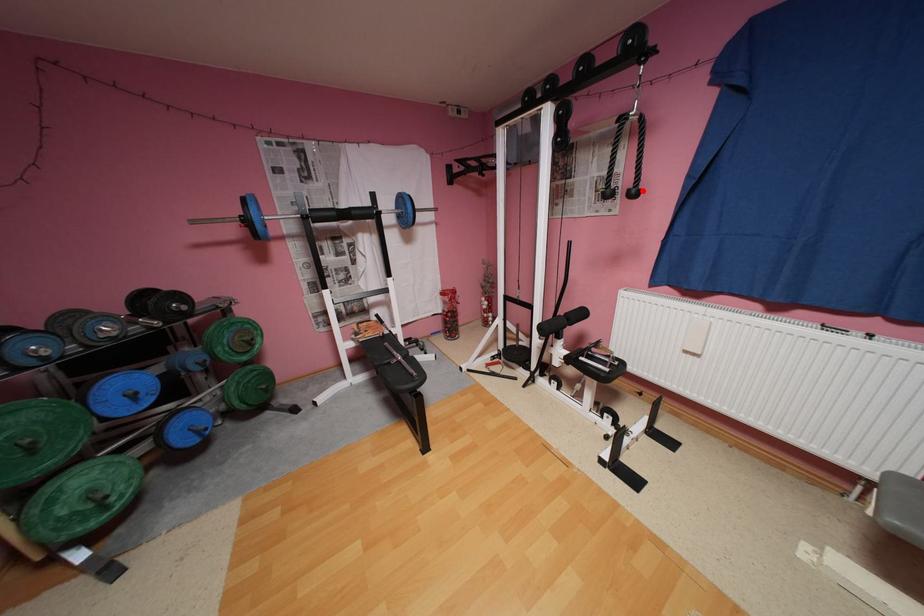
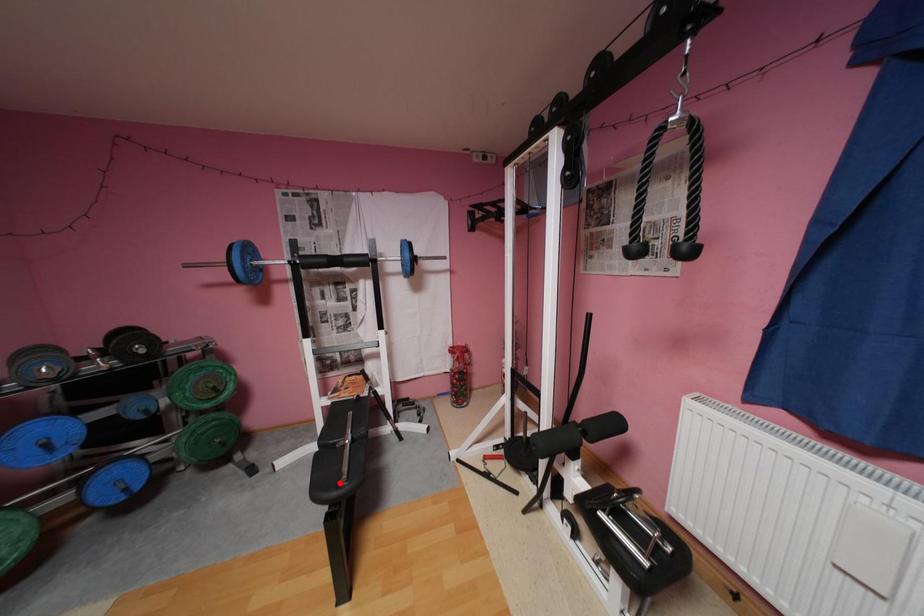
I am providing you with two images of the same scene from different viewpoints. A red point is marked on the first image and another point is marked on the second image. Is the red point in image1 aligned with the point shown in image2?

No